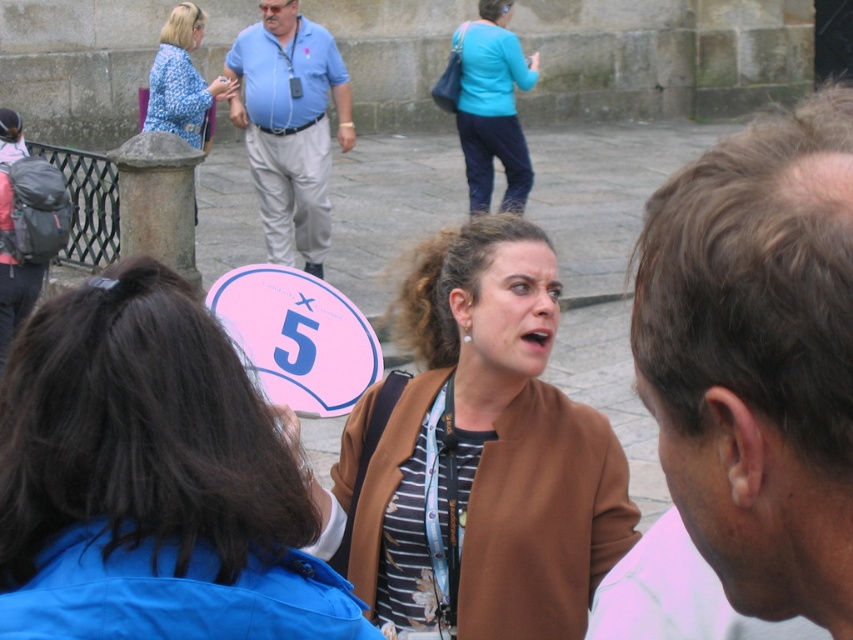
Who is positioned more to the left, brown fabric jacket at center or teal fabric top at upper center?

brown fabric jacket at center

Locate an element on the screen. This screenshot has width=853, height=640. brown fabric jacket at center is located at coordinates (x=489, y=451).

Does point (358, 554) come closer to viewer compared to point (503, 202)?

Yes, point (358, 554) is in front of point (503, 202).

The height and width of the screenshot is (640, 853). I want to click on brown fabric jacket at center, so click(x=489, y=451).

Which of these two, teal fabric top at upper center or blue printed blouse at upper left, stands taller?

With more height is teal fabric top at upper center.

Is teal fabric top at upper center positioned behind blue printed blouse at upper left?

That is True.

Locate an element on the screen. This screenshot has width=853, height=640. teal fabric top at upper center is located at coordinates (492, 106).

Find the location of a particular element. This screenshot has width=853, height=640. teal fabric top at upper center is located at coordinates (492, 106).

Can you confirm if light brown hair at center is positioned above blue shirt at center?

No, light brown hair at center is not above blue shirt at center.

Is light brown hair at center positioned in front of blue shirt at center?

Yes, it is.

Identify the location of light brown hair at center. The height and width of the screenshot is (640, 853). tap(747, 388).